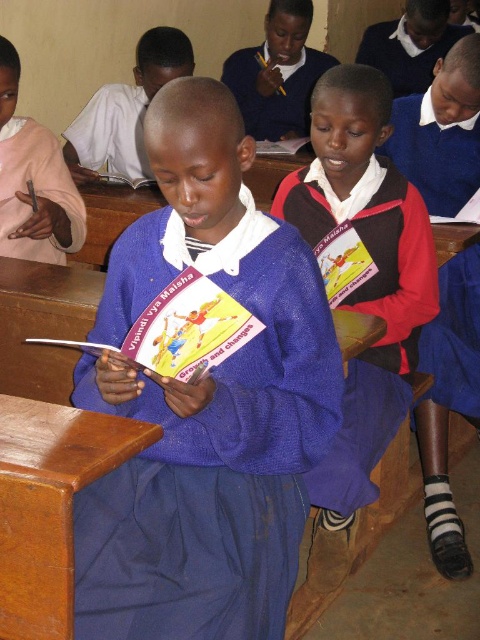
In the scene shown: You are a photographer standing at the camera position. You want to capture a closeup shot of the blue knitted sweater at center without moving the camera. Is it possible to do so with the current distance?

The blue knitted sweater at center and camera are 3.65 feet apart. Since 3.65 feet is a reasonable distance for a closeup shot, yes, the photographer can capture a closeup of the blue knitted sweater at center without moving the camera.

You are a student in the classroom looking at the image. Where is the matte blue sweater at center located in terms of coordinates?

The matte blue sweater at center is located at coordinates point [361,272].